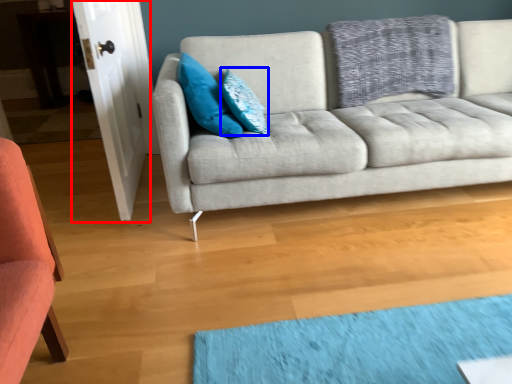
Question: Which object appears closest to the camera in this image, door (highlighted by a red box) or pillow (highlighted by a blue box)?

Choices:
 (A) door
 (B) pillow

Answer: (A)